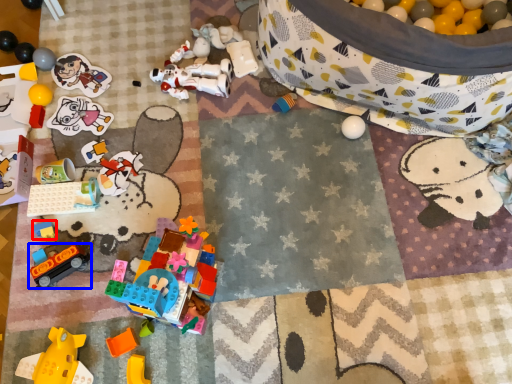
Question: Which of the following is the farthest to the observer, toy (highlighted by a red box) or toy (highlighted by a blue box)?

Choices:
 (A) toy
 (B) toy

Answer: (A)